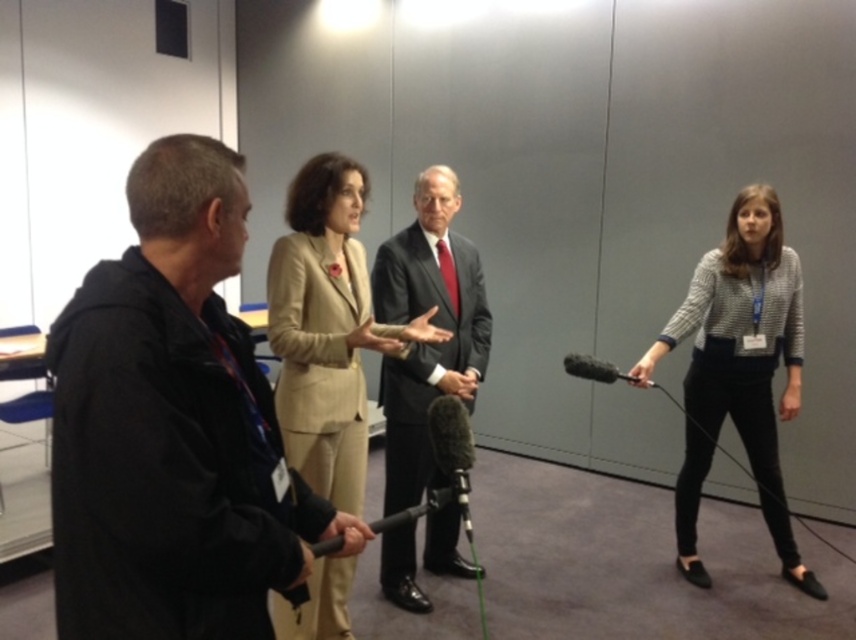
Question: Which point is farther to the camera?

Choices:
 (A) knit sweater at right
 (B) black foam microphone at right
 (C) beige fabric suit at center
 (D) black matte jacket at left

Answer: (A)

Question: Considering the relative positions of black matte jacket at left and dark gray suit at center in the image provided, where is black matte jacket at left located with respect to dark gray suit at center?

Choices:
 (A) right
 (B) left

Answer: (B)

Question: Does black matte jacket at left come behind black foam microphone at right?

Choices:
 (A) no
 (B) yes

Answer: (A)

Question: Estimate the real-world distances between objects in this image. Which object is closer to the beige fabric suit at center?

Choices:
 (A) knit sweater at right
 (B) black matte microphone at center

Answer: (B)

Question: Is beige fabric suit at center to the right of dark gray suit at center from the viewer's perspective?

Choices:
 (A) yes
 (B) no

Answer: (B)

Question: Which point is closer to the camera taking this photo?

Choices:
 (A) (325, 272)
 (B) (385, 483)
 (C) (716, 256)

Answer: (A)